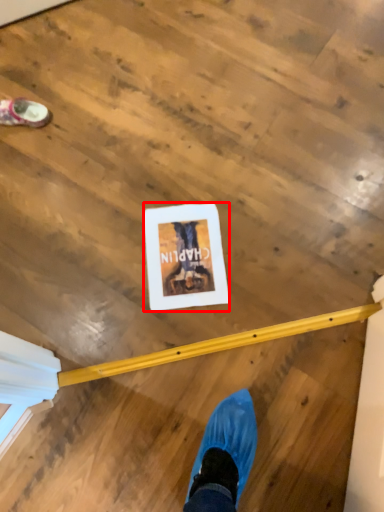
Question: Where is postcard (annotated by the red box) located in relation to footwear in the image?

Choices:
 (A) left
 (B) right

Answer: (B)